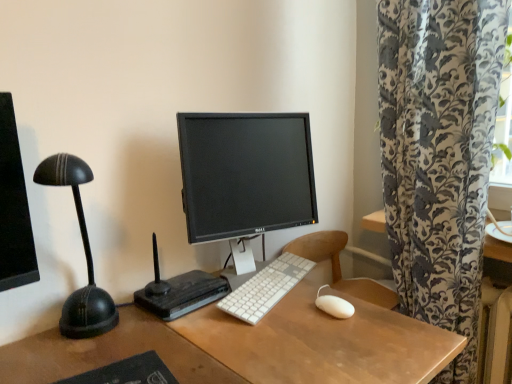
Question: From the image's perspective, would you say white matte mouse at center is shown under white plastic keyboard at center?

Choices:
 (A) no
 (B) yes

Answer: (B)

Question: From a real-world perspective, is white matte mouse at center physically above white plastic keyboard at center?

Choices:
 (A) no
 (B) yes

Answer: (B)

Question: Considering the relative sizes of white matte mouse at center and white plastic keyboard at center in the image provided, is white matte mouse at center smaller than white plastic keyboard at center?

Choices:
 (A) no
 (B) yes

Answer: (B)

Question: Does white matte mouse at center have a lesser width compared to white plastic keyboard at center?

Choices:
 (A) yes
 (B) no

Answer: (A)

Question: Is white matte mouse at center located outside white plastic keyboard at center?

Choices:
 (A) no
 (B) yes

Answer: (B)

Question: From a real-world perspective, is black plastic router at center positioned above or below black rubber mousepad at lower left?

Choices:
 (A) below
 (B) above

Answer: (B)

Question: Which is correct: black plastic router at center is inside black rubber mousepad at lower left, or outside of it?

Choices:
 (A) outside
 (B) inside

Answer: (A)

Question: Is black plastic router at center in front of or behind black rubber mousepad at lower left in the image?

Choices:
 (A) behind
 (B) front

Answer: (A)

Question: From their relative heights in the image, would you say black plastic router at center is taller or shorter than black rubber mousepad at lower left?

Choices:
 (A) short
 (B) tall

Answer: (B)

Question: Considering the positions of point tap(350, 304) and point tap(152, 372), is point tap(350, 304) closer or farther from the camera than point tap(152, 372)?

Choices:
 (A) farther
 (B) closer

Answer: (A)

Question: Is white matte mouse at center inside the boundaries of black rubber mousepad at lower left, or outside?

Choices:
 (A) outside
 (B) inside

Answer: (A)

Question: Is white matte mouse at center wider or thinner than black rubber mousepad at lower left?

Choices:
 (A) thin
 (B) wide

Answer: (A)

Question: In the image, is white matte mouse at center positioned in front of or behind black rubber mousepad at lower left?

Choices:
 (A) behind
 (B) front

Answer: (A)

Question: In terms of size, does black glossy monitor at center appear bigger or smaller than black rubber mousepad at lower left?

Choices:
 (A) small
 (B) big

Answer: (B)

Question: Relative to black rubber mousepad at lower left, is black glossy monitor at center in front or behind?

Choices:
 (A) front
 (B) behind

Answer: (B)